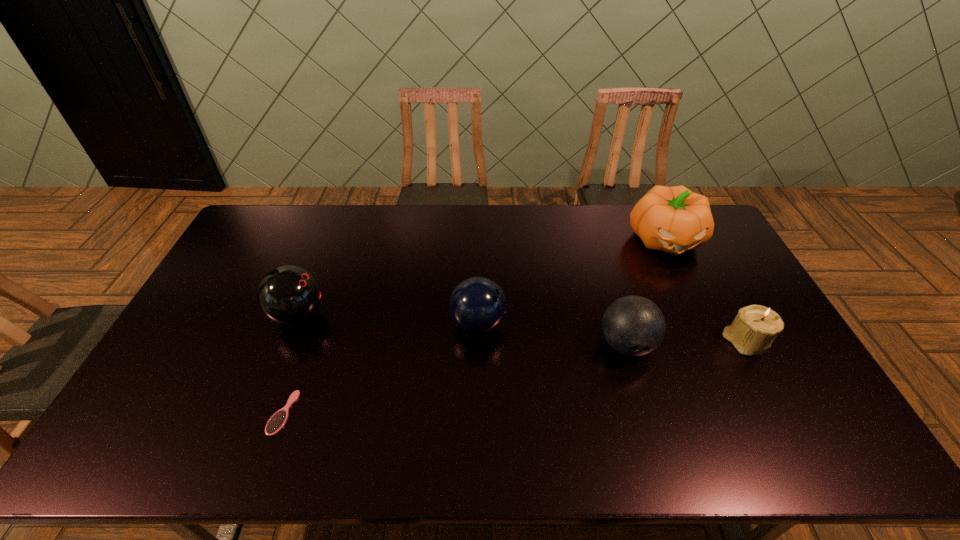
Locate an element on the screen. The width and height of the screenshot is (960, 540). free space located 0.280m on the surface of the second bowling ball from left to right near the finger holes is located at coordinates (598, 323).

This screenshot has height=540, width=960. I want to click on vacant space situated on the left of the candle_holder, so click(677, 342).

Locate an element on the screen. vacant region located 0.310m on the left of the shortest object is located at coordinates (150, 413).

You are a GUI agent. You are given a task and a screenshot of the screen. Output one action in this format:
    pyautogui.click(x=<x>, y=<y>)
    Task: Click on the object located at the far edge
    The width and height of the screenshot is (960, 540).
    Given the screenshot: What is the action you would take?
    pyautogui.click(x=674, y=219)

I want to click on object at the near edge, so click(x=277, y=421).

Image resolution: width=960 pixels, height=540 pixels. In order to click on pumpkin that is at the right edge in this screenshot , I will do `click(674, 219)`.

Find the location of a particular element. The image size is (960, 540). candle_holder located in the right edge section of the desktop is located at coordinates (755, 327).

Locate an element on the screen. object positioned at the far right corner is located at coordinates (674, 219).

In the image, there is a desktop. Where is `vacant space at the far edge`? vacant space at the far edge is located at coordinates (414, 238).

Where is `free location at the near edge`? free location at the near edge is located at coordinates [451, 446].